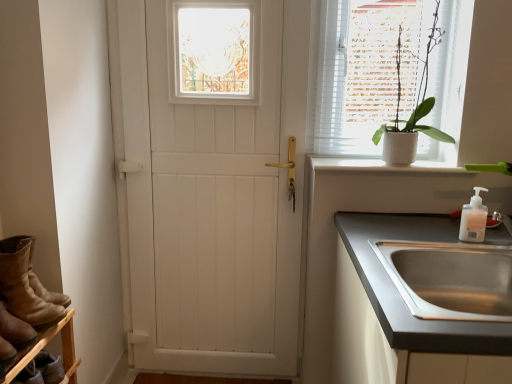
Question: Does brown suede boot at lower left come in front of brown wooden shelf at lower left?

Choices:
 (A) no
 (B) yes

Answer: (B)

Question: Considering the relative sizes of brown suede boot at lower left and brown wooden shelf at lower left in the image provided, is brown suede boot at lower left taller than brown wooden shelf at lower left?

Choices:
 (A) yes
 (B) no

Answer: (A)

Question: Would you say brown suede boot at lower left is outside brown wooden shelf at lower left?

Choices:
 (A) no
 (B) yes

Answer: (B)

Question: Is brown suede boot at lower left to the left of brown wooden shelf at lower left from the viewer's perspective?

Choices:
 (A) no
 (B) yes

Answer: (B)

Question: From a real-world perspective, is brown suede boot at lower left located higher than brown wooden shelf at lower left?

Choices:
 (A) no
 (B) yes

Answer: (B)

Question: Can you confirm if brown suede boot at lower left is bigger than brown wooden shelf at lower left?

Choices:
 (A) no
 (B) yes

Answer: (B)

Question: From a real-world perspective, is stainless steel sink at lower right positioned under brown suede boots at lower left based on gravity?

Choices:
 (A) no
 (B) yes

Answer: (A)

Question: Does stainless steel sink at lower right lie behind brown suede boots at lower left?

Choices:
 (A) yes
 (B) no

Answer: (B)

Question: From a real-world perspective, is stainless steel sink at lower right on top of brown suede boots at lower left?

Choices:
 (A) yes
 (B) no

Answer: (A)

Question: Is stainless steel sink at lower right shorter than brown suede boots at lower left?

Choices:
 (A) yes
 (B) no

Answer: (A)

Question: Can you confirm if stainless steel sink at lower right is thinner than brown suede boots at lower left?

Choices:
 (A) no
 (B) yes

Answer: (A)

Question: Is stainless steel sink at lower right facing towards brown suede boots at lower left?

Choices:
 (A) no
 (B) yes

Answer: (A)

Question: Is brown suede boots at lower left taller than brown suede boot at lower left?

Choices:
 (A) yes
 (B) no

Answer: (A)